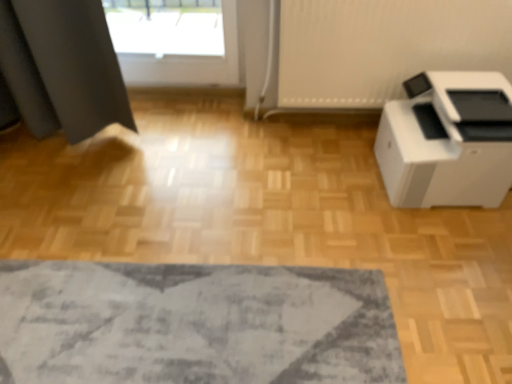
Find the location of a particular element. This screenshot has width=512, height=384. white plastic printer at right is located at coordinates (448, 140).

This screenshot has width=512, height=384. What do you see at coordinates (448, 140) in the screenshot?
I see `white plastic printer at right` at bounding box center [448, 140].

Where is `textured gray rug at lower center`? This screenshot has height=384, width=512. textured gray rug at lower center is located at coordinates (194, 324).

What do you see at coordinates (194, 324) in the screenshot?
I see `textured gray rug at lower center` at bounding box center [194, 324].

Identify the location of white plastic printer at right. The image size is (512, 384). (448, 140).

Is textured gray rug at lower center to the left of white plastic printer at right from the viewer's perspective?

Correct, you'll find textured gray rug at lower center to the left of white plastic printer at right.

Between textured gray rug at lower center and white plastic printer at right, which one is positioned behind?

white plastic printer at right is further away from the camera.

Considering the points (202, 359) and (499, 201), which point is behind, point (202, 359) or point (499, 201)?

Point (499, 201)

From the image's perspective, is textured gray rug at lower center located above white plastic printer at right?

No, from the image's perspective, textured gray rug at lower center is not over white plastic printer at right.

From a real-world perspective, is textured gray rug at lower center located beneath white plastic printer at right?

Correct, in the physical world, textured gray rug at lower center is lower than white plastic printer at right.

Between textured gray rug at lower center and white plastic printer at right, which one has larger width?

textured gray rug at lower center.

Does textured gray rug at lower center have a lesser height compared to white plastic printer at right?

Indeed, textured gray rug at lower center has a lesser height compared to white plastic printer at right.

Considering the sizes of textured gray rug at lower center and white plastic printer at right in the image, is textured gray rug at lower center bigger or smaller than white plastic printer at right?

Considering their sizes, textured gray rug at lower center takes up less space than white plastic printer at right.

Is textured gray rug at lower center located outside white plastic printer at right?

Yes, textured gray rug at lower center is located beyond the bounds of white plastic printer at right.

Is textured gray rug at lower center not near white plastic printer at right?

They are positioned close to each other.

Is textured gray rug at lower center facing away from white plastic printer at right?

That's not correct — textured gray rug at lower center is not looking away from white plastic printer at right.

Identify the location of home appliance that is above the textured gray rug at lower center (from a real-world perspective). (448, 140).

Considering the relative positions of white plastic printer at right and textured gray rug at lower center in the image provided, is white plastic printer at right to the left of textured gray rug at lower center from the viewer's perspective?

No.

Based on the photo, is the position of white plastic printer at right more distant than that of textured gray rug at lower center?

Yes, the depth of white plastic printer at right is greater than that of textured gray rug at lower center.

Is point (483, 75) positioned before point (121, 376)?

No.

From the image's perspective, which is above, white plastic printer at right or textured gray rug at lower center?

white plastic printer at right.

From a real-world perspective, is white plastic printer at right physically above textured gray rug at lower center?

Indeed, from a real-world perspective, white plastic printer at right stands above textured gray rug at lower center.

Looking at this image, considering the sizes of objects white plastic printer at right and textured gray rug at lower center in the image provided, who is thinner, white plastic printer at right or textured gray rug at lower center?

white plastic printer at right.

Does white plastic printer at right have a lesser height compared to textured gray rug at lower center?

Incorrect, the height of white plastic printer at right does not fall short of that of textured gray rug at lower center.

Can you confirm if white plastic printer at right is smaller than textured gray rug at lower center?

Incorrect, white plastic printer at right is not smaller in size than textured gray rug at lower center.

Is textured gray rug at lower center inside white plastic printer at right?

Definitely not — textured gray rug at lower center is not inside white plastic printer at right.

Does white plastic printer at right touch textured gray rug at lower center?

No, white plastic printer at right is not in contact with textured gray rug at lower center.

In the scene shown: Is textured gray rug at lower center at the back of white plastic printer at right?

No.

How many degrees apart are the facing directions of white plastic printer at right and textured gray rug at lower center?

90.6 degrees separate the facing orientations of white plastic printer at right and textured gray rug at lower center.

Find the location of a particular element. Image resolution: width=512 pixels, height=384 pixels. mat that is under the white plastic printer at right (from a real-world perspective) is located at coordinates (194, 324).

Identify the location of mat below the white plastic printer at right (from the image's perspective). The height and width of the screenshot is (384, 512). (194, 324).

Locate an element on the screen. mat below the white plastic printer at right (from a real-world perspective) is located at coordinates (194, 324).